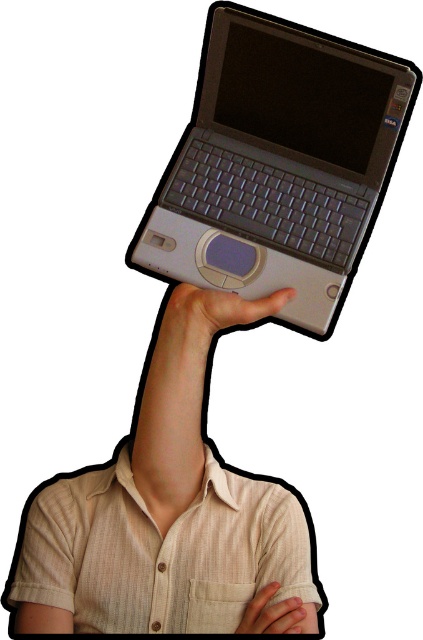
Is matte gray laptop at upper center further to the viewer compared to matte gray hand at upper center?

Yes, it is behind matte gray hand at upper center.

Between matte gray laptop at upper center and matte gray hand at upper center, which one has less height?

matte gray hand at upper center

Is point (203, 296) positioned behind point (279, 627)?

Yes, point (203, 296) is behind point (279, 627).

Where is `matte gray laptop at upper center`? The height and width of the screenshot is (640, 423). matte gray laptop at upper center is located at coordinates [214, 310].

Who is positioned more to the left, satin silver laptop at upper center or matte gray laptop at upper center?

matte gray laptop at upper center

The height and width of the screenshot is (640, 423). What are the coordinates of `satin silver laptop at upper center` in the screenshot? It's located at (277, 164).

Describe the element at coordinates (277, 164) in the screenshot. I see `satin silver laptop at upper center` at that location.

Identify the location of satin silver laptop at upper center. (277, 164).

Can you confirm if satin silver laptop at upper center is positioned to the left of matte gray hand at upper center?

Incorrect, satin silver laptop at upper center is not on the left side of matte gray hand at upper center.

Measure the distance between satin silver laptop at upper center and matte gray hand at upper center.

satin silver laptop at upper center and matte gray hand at upper center are 21.76 inches apart from each other.

In order to click on satin silver laptop at upper center in this screenshot , I will do `click(277, 164)`.

Find the location of a particular element. This screenshot has height=640, width=423. satin silver laptop at upper center is located at coordinates (277, 164).